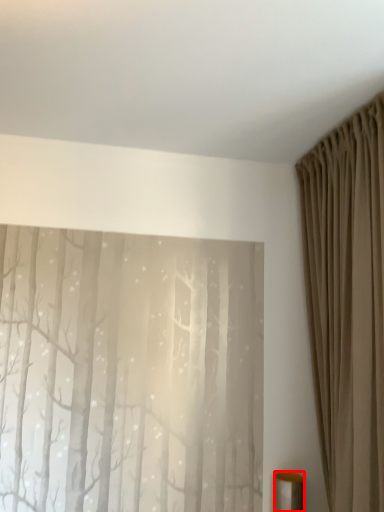
Question: From the image's perspective, where is furniture (annotated by the red box) located in relation to curtain in the image?

Choices:
 (A) below
 (B) above

Answer: (A)